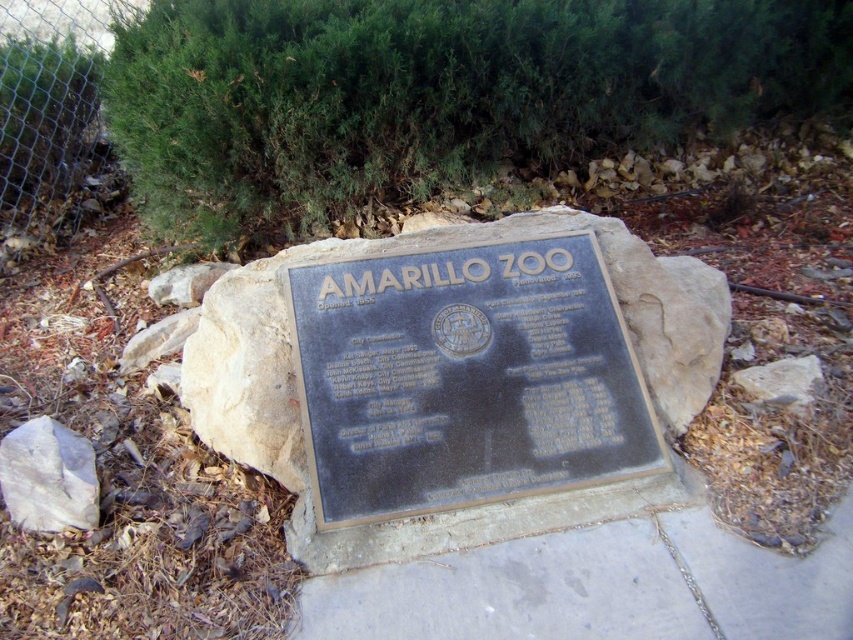
Question: Is gray concrete pavement at center wider than metal mesh fence at upper left?

Choices:
 (A) no
 (B) yes

Answer: (B)

Question: Among these objects, which one is nearest to the camera?

Choices:
 (A) green leafy bush at upper center
 (B) bronze plaque at center

Answer: (B)

Question: Is gray concrete pavement at center positioned behind white rough rock at lower left?

Choices:
 (A) no
 (B) yes

Answer: (A)

Question: Which point appears farthest from the camera in this image?

Choices:
 (A) (297, 323)
 (B) (70, 170)
 (C) (738, 605)
 (D) (79, 520)

Answer: (B)

Question: Can you confirm if bronze plaque at center is positioned to the left of gray concrete pavement at center?

Choices:
 (A) yes
 (B) no

Answer: (A)

Question: Based on their relative distances, which object is farther from the gray concrete pavement at center?

Choices:
 (A) metal mesh fence at upper left
 (B) white rough rock at lower left
 (C) bronze plaque at center
 (D) green leafy bush at upper center

Answer: (A)